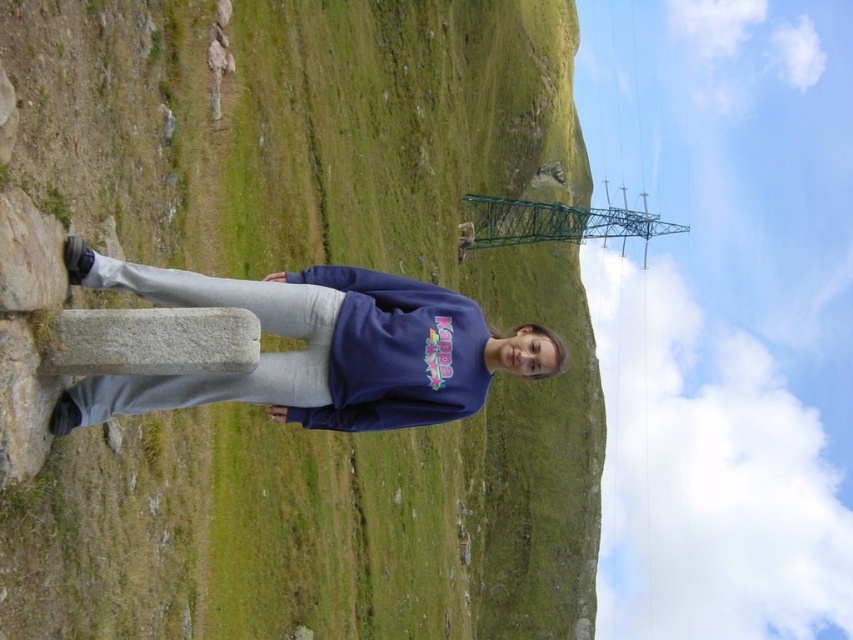
Is green grassy hillside at center bigger than matte blue sweatshirt at center?

Yes, green grassy hillside at center is bigger than matte blue sweatshirt at center.

Does green grassy hillside at center appear under matte blue sweatshirt at center?

No, green grassy hillside at center is not below matte blue sweatshirt at center.

Is point (440, 632) positioned in front of point (173, 296)?

No, (440, 632) is behind (173, 296).

Identify the location of green grassy hillside at center. (297, 268).